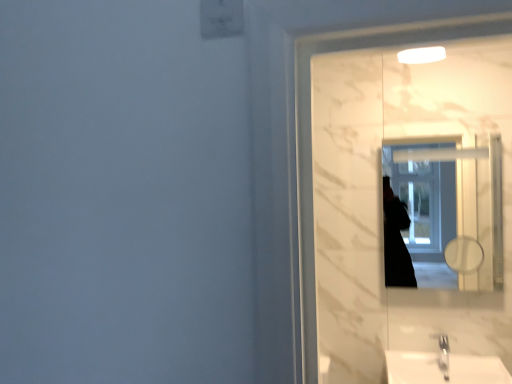
Question: Would you say white glossy mirror at upper right is to the left or to the right of white glossy sink at lower right in the picture?

Choices:
 (A) left
 (B) right

Answer: (A)

Question: Is white glossy mirror at upper right in front of or behind white glossy sink at lower right in the image?

Choices:
 (A) front
 (B) behind

Answer: (B)

Question: From the image's perspective, is white glossy mirror at upper right above or below white glossy sink at lower right?

Choices:
 (A) above
 (B) below

Answer: (A)

Question: Would you say white glossy sink at lower right is to the left or to the right of white glossy mirror at upper right in the picture?

Choices:
 (A) left
 (B) right

Answer: (B)

Question: Is point (487, 355) closer or farther from the camera than point (461, 168)?

Choices:
 (A) farther
 (B) closer

Answer: (B)

Question: From the image's perspective, is white glossy sink at lower right above or below white glossy mirror at upper right?

Choices:
 (A) above
 (B) below

Answer: (B)

Question: Considering the positions of white glossy sink at lower right and white glossy mirror at upper right in the image, is white glossy sink at lower right taller or shorter than white glossy mirror at upper right?

Choices:
 (A) tall
 (B) short

Answer: (B)